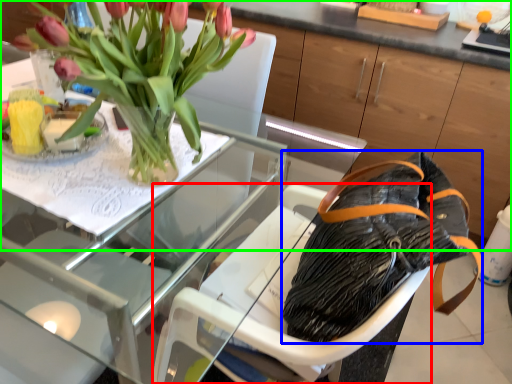
Question: Estimate the real-world distances between objects in this image. Which object is closer to armchair (highlighted by a red box), handbag (highlighted by a blue box) or dresser (highlighted by a green box)?

Choices:
 (A) handbag
 (B) dresser

Answer: (A)